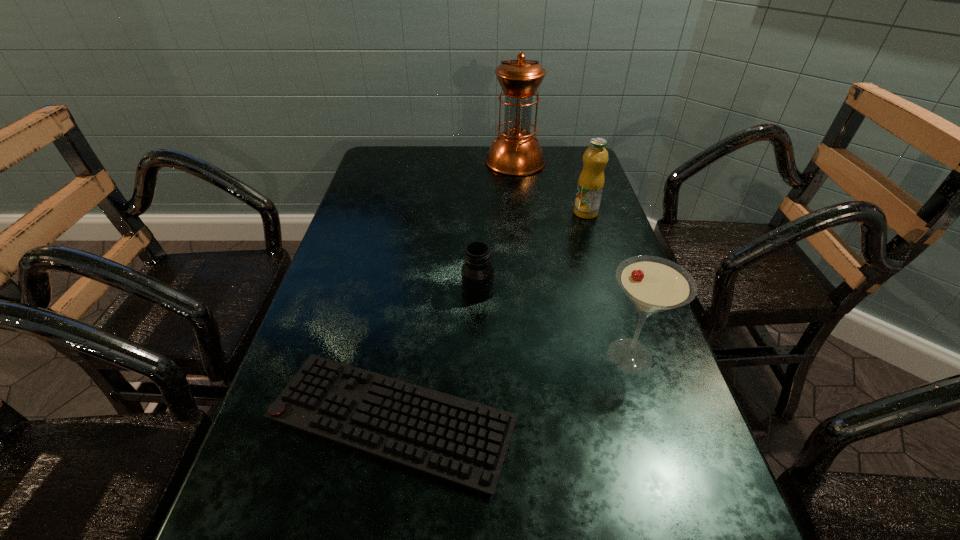
You are a GUI agent. You are given a task and a screenshot of the screen. Output one action in this format:
    pyautogui.click(x=<x>, y=<y>)
    Task: Click on the vacant space at the far left corner of the desktop
    This screenshot has width=960, height=540.
    Given the screenshot: What is the action you would take?
    pyautogui.click(x=400, y=163)

Find the location of a particular element. Image resolution: width=960 pixels, height=540 pixels. free space at the far right corner of the desktop is located at coordinates (572, 159).

Locate an element on the screen. The image size is (960, 540). vacant space that is in between the computer keyboard and the martini is located at coordinates (511, 388).

The height and width of the screenshot is (540, 960). Identify the location of free space between the computer keyboard and the martini. (511, 388).

Locate an element on the screen. free space between the second farthest object and the second shortest object is located at coordinates (532, 252).

The width and height of the screenshot is (960, 540). What are the coordinates of `blank region between the second farthest object and the oil lamp` in the screenshot? It's located at (550, 187).

This screenshot has width=960, height=540. In order to click on blank region between the farthest object and the fruit juice in this screenshot , I will do `click(550, 187)`.

I want to click on vacant space in between the third farthest object and the shortest object, so (435, 356).

Find the location of a particular element. The image size is (960, 540). the closest object to the martini is located at coordinates (464, 442).

Point out which object is positioned as the nearest to the shortest object. Please provide its 2D coordinates. Your answer should be formatted as a tuple, i.e. [(x, y)], where the tuple contains the x and y coordinates of a point satisfying the conditions above.

[(477, 273)]